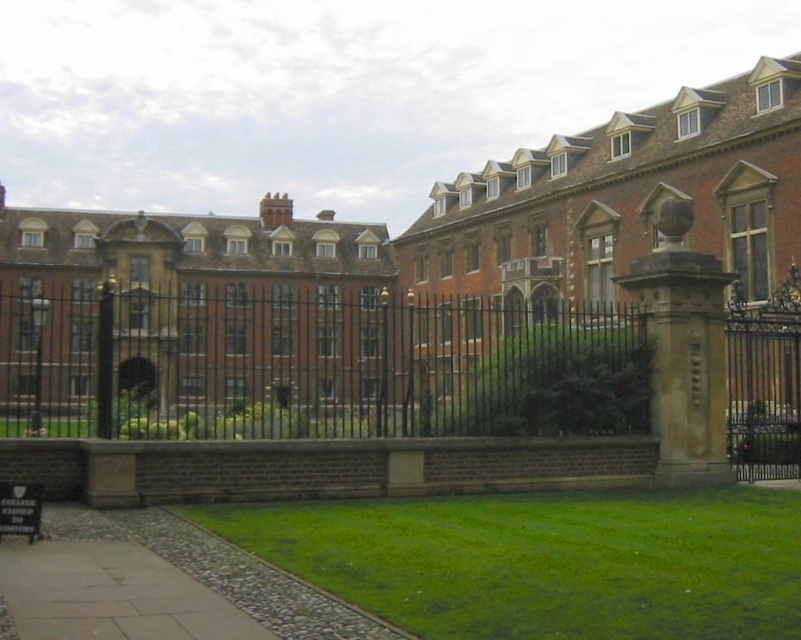
You are a photographer standing in front of the brick building at center and the black wrought iron fence at center. You want to capture a photo that includes both objects in the frame. Which object should you position closer to the camera to ensure both are fully visible?

To ensure both the brick building at center and the black wrought iron fence at center are fully visible in the photo, you should position the black wrought iron fence at center closer to the camera. Since the brick building at center is taller than the fence, placing the shorter fence nearer will help balance their sizes in the frame, allowing both to be captured without one overpowering the other.

You are a maintenance worker needing to access the green grass at lower center for landscaping. The black wrought iron fence at center is blocking your path. Can you step over the fence to reach the grass?

The black wrought iron fence at center has a greater height compared to green grass at lower center. Since the fence is taller than the grass, you would need to find another way around or use a tool to access the grass without stepping over the fence.

You are standing in front of the historic building and want to take a photo of the black wrought iron fence at center. According to the scene description, where should you position yourself to capture the fence in the center of your photo?

To center the black wrought iron fence at center in your photo, position yourself directly in front of the fence at the point specified by its 2D location coordinates, which are at point (x=314, y=368).